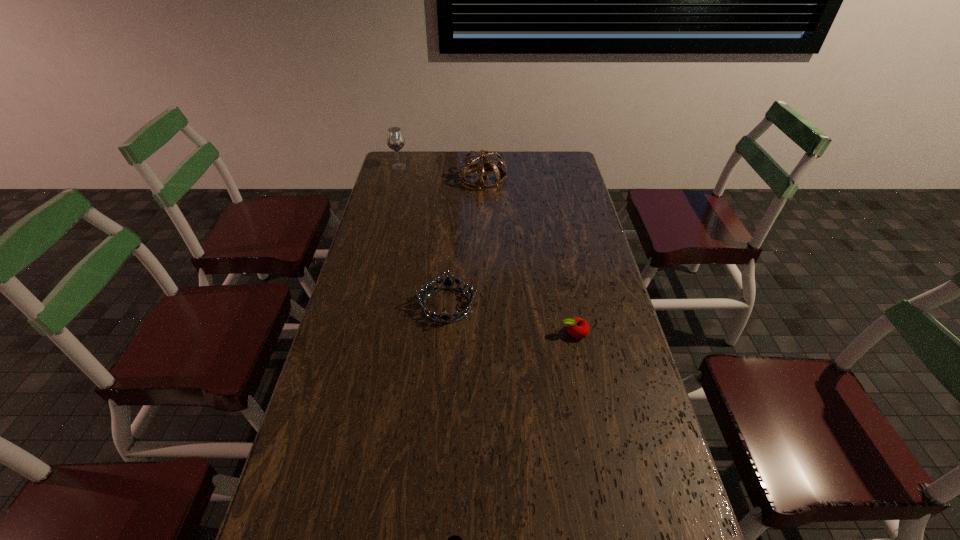
At what (x,y) coordinates should I click in order to perform the action: click on wineglass. Please return your answer as a coordinate pair (x, y). The width and height of the screenshot is (960, 540). Looking at the image, I should click on (395, 140).

The width and height of the screenshot is (960, 540). Identify the location of the leftmost object. (395, 140).

At what (x,y) coordinates should I click in order to perform the action: click on the farther tiara. Please return your answer as a coordinate pair (x, y). The width and height of the screenshot is (960, 540). Looking at the image, I should click on (484, 162).

This screenshot has width=960, height=540. Identify the location of the taller tiara. (484, 162).

At what (x,y) coordinates should I click in order to perform the action: click on the nearer tiara. Please return your answer as a coordinate pair (x, y). The width and height of the screenshot is (960, 540). Looking at the image, I should click on (447, 283).

At what (x,y) coordinates should I click in order to perform the action: click on the second shortest object. Please return your answer as a coordinate pair (x, y). Looking at the image, I should click on (578, 328).

Where is `apple`? apple is located at coordinates (578, 328).

Find the location of a particular element. This screenshot has height=540, width=960. vacant space situated on the right of the tallest object is located at coordinates (468, 167).

Locate an element on the screen. The width and height of the screenshot is (960, 540). vacant space located on the front of the farther tiara is located at coordinates tap(483, 234).

Identify the location of vacant point located on the front-facing side of the shorter tiara. The height and width of the screenshot is (540, 960). (596, 305).